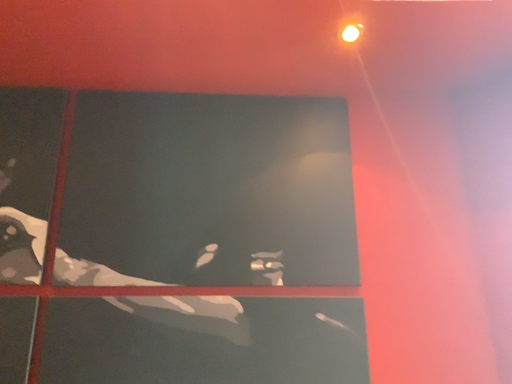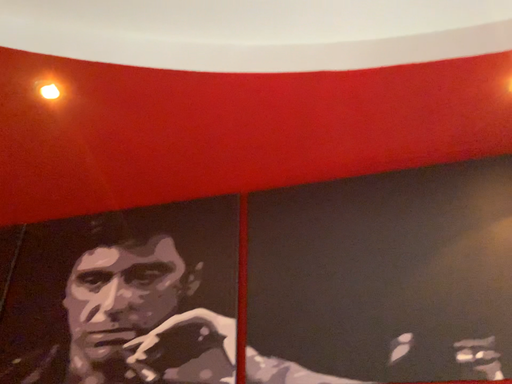
Question: Which way did the camera rotate in the video?

Choices:
 (A) rotated right
 (B) rotated left

Answer: (B)